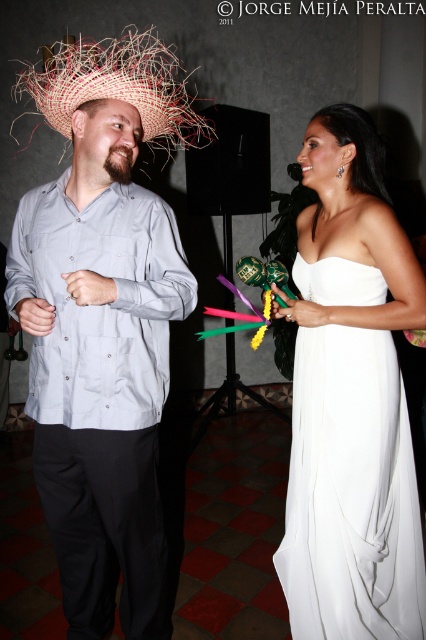
Question: Which of the following is the closest to the observer?

Choices:
 (A) matte straw hat at left
 (B) white satin dress at right
 (C) straw hat at upper left

Answer: (A)

Question: Is white satin dress at right further to the viewer compared to straw hat at upper left?

Choices:
 (A) yes
 (B) no

Answer: (A)

Question: Which object is positioned farthest from the white satin dress at right?

Choices:
 (A) straw hat at upper left
 (B) matte straw hat at left

Answer: (A)

Question: Does matte straw hat at left come behind white satin dress at right?

Choices:
 (A) no
 (B) yes

Answer: (A)

Question: Is matte straw hat at left wider than white satin dress at right?

Choices:
 (A) yes
 (B) no

Answer: (A)

Question: Estimate the real-world distances between objects in this image. Which object is farther from the white satin dress at right?

Choices:
 (A) matte straw hat at left
 (B) straw hat at upper left

Answer: (B)